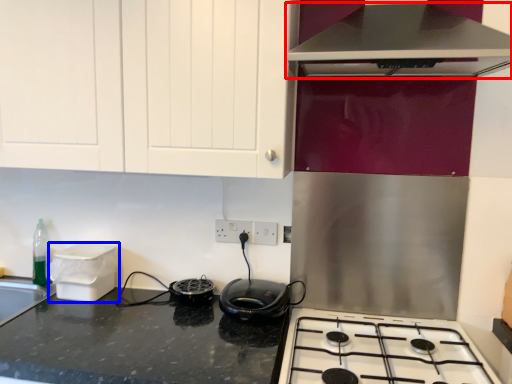
Question: Which object is closer to the camera taking this photo, home appliance (highlighted by a red box) or appliance (highlighted by a blue box)?

Choices:
 (A) home appliance
 (B) appliance

Answer: (A)